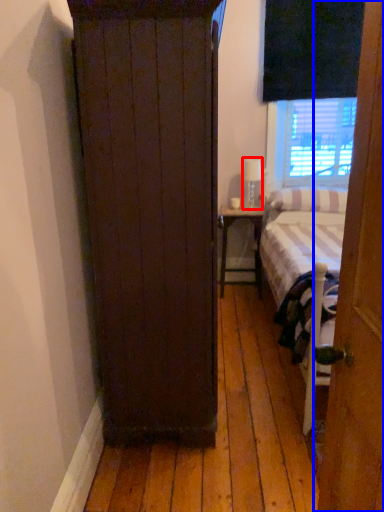
Question: Which point is further to the camera, lamp (highlighted by a red box) or door (highlighted by a blue box)?

Choices:
 (A) lamp
 (B) door

Answer: (A)